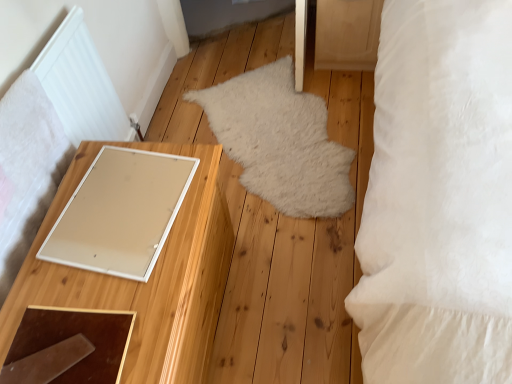
The width and height of the screenshot is (512, 384). Identify the location of vacant space in between white matte mirror at left and wooden drawer at upper right. (268, 161).